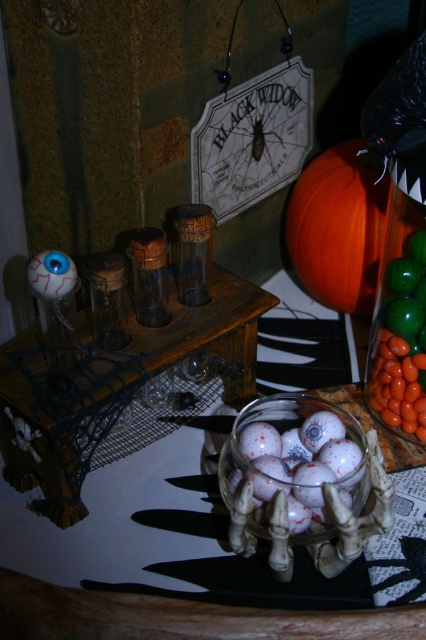
You are a child reaching for the translucent glass candy at right while standing in front of the Halloween display. Will your hand pass in front of the orange matte pumpkin at upper right before touching the candy?

Yes, because the orange matte pumpkin at upper right is closer to you than the translucent glass candy at right, so your hand would pass in front of the pumpkin before reaching the candy.